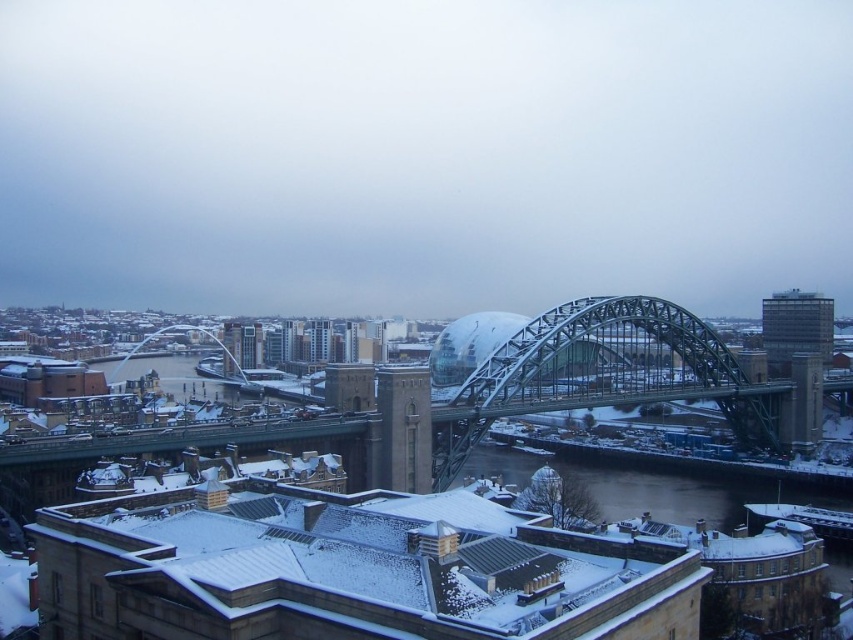
Question: Is metallic steel bridge at center to the left of glassy reflective building at upper right from the viewer's perspective?

Choices:
 (A) no
 (B) yes

Answer: (B)

Question: Which of the following is the farthest from the observer?

Choices:
 (A) metallic steel bridge at center
 (B) glassy reflective building at upper right

Answer: (B)

Question: Does metallic steel bridge at center appear on the left side of glassy reflective building at upper right?

Choices:
 (A) yes
 (B) no

Answer: (A)

Question: Among these points, which one is farthest from the camera?

Choices:
 (A) (817, 333)
 (B) (674, 348)

Answer: (A)

Question: Is metallic steel bridge at center above glassy reflective building at upper right?

Choices:
 (A) yes
 (B) no

Answer: (B)